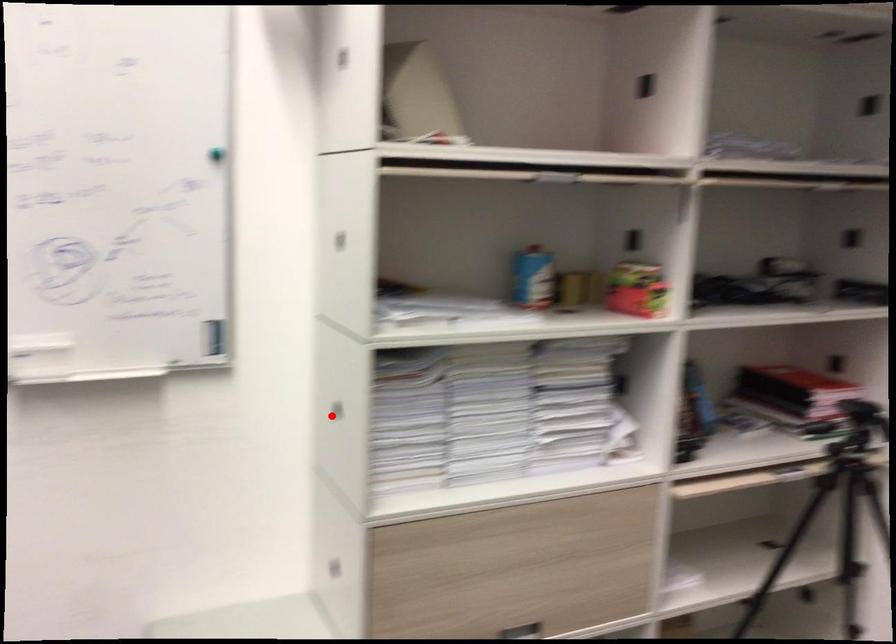
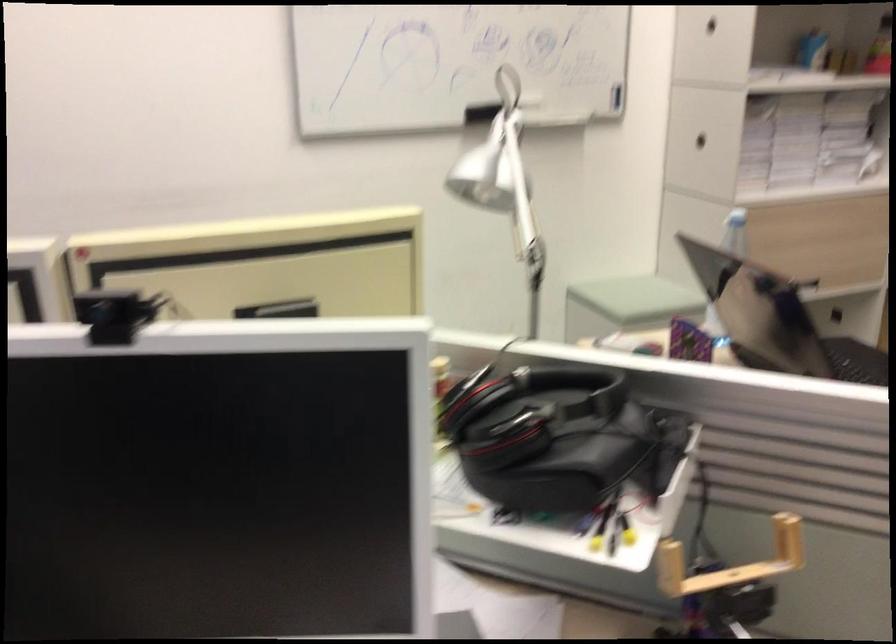
Question: I am providing you with two images of the same scene from different viewpoints. Image1 has a red point marked. In image2, the corresponding 3D location appears at what relative position? Reply with the corresponding letter.

Choices:
 (A) Closer
 (B) Farther

Answer: (B)